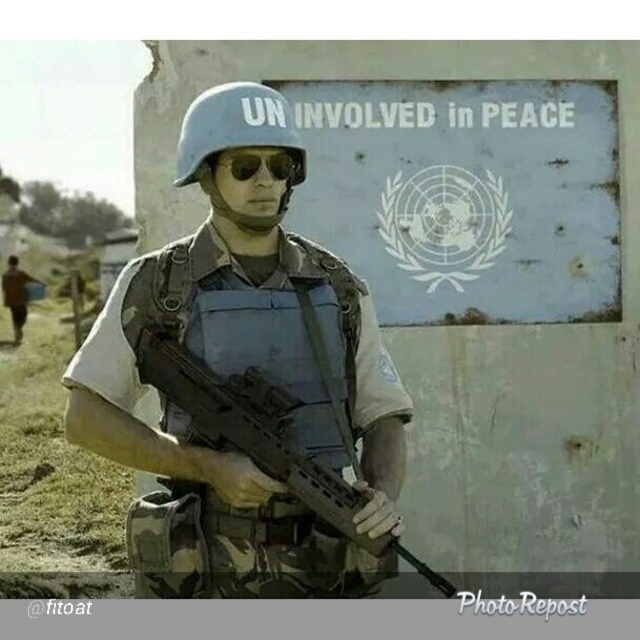
Consider the image. You are a photographer trying to capture a clear shot of the UN emblem on the wall. You notice the matte black rifle at center and the brown fabric shirt at lower left are blocking your view. Which object is closer to the camera, making it the main obstruction?

The matte black rifle at center is located below brown fabric shirt at lower left, so the brown fabric shirt at lower left is closer to the camera and is the main obstruction.

You are a photographer trying to capture the soldier in the scene. You want to focus on the matte black rifle at center and the brown fabric shirt at lower left. Which object should you adjust your camera focus on first if you want to ensure both are in focus?

The matte black rifle at center is closer to the viewer than the brown fabric shirt at lower left. To ensure both are in focus, you should focus on the matte black rifle at center first, as it is the closer object.